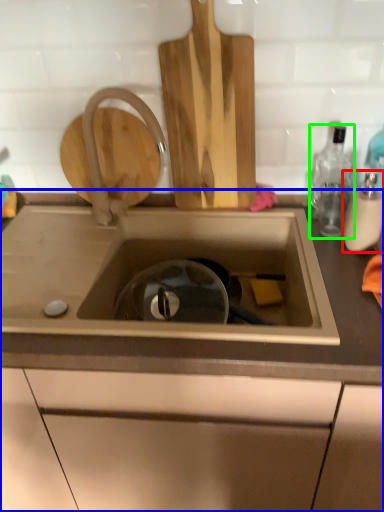
Question: Which object is the farthest from bottle (highlighted by a red box)? Choose among these: countertop (highlighted by a blue box) or bottle (highlighted by a green box).

Choices:
 (A) countertop
 (B) bottle

Answer: (A)